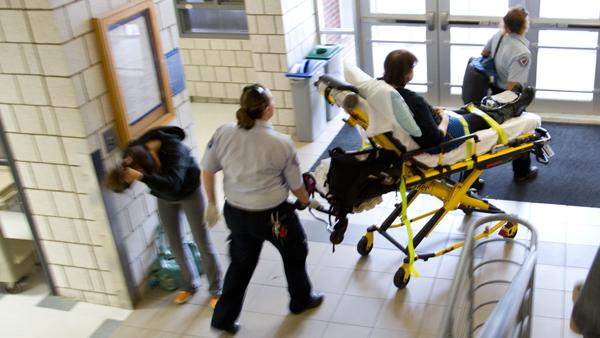
You are a GUI agent. You are given a task and a screenshot of the screen. Output one action in this format:
    pyautogui.click(x=<x>, y=<y>)
    Task: Click on the wall
    The height and width of the screenshot is (338, 600).
    Given the screenshot: What is the action you would take?
    pyautogui.click(x=57, y=93), pyautogui.click(x=260, y=38)